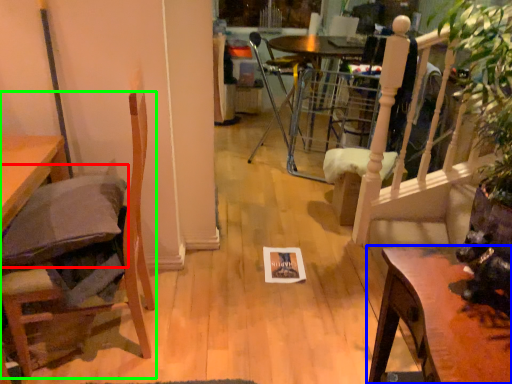
Question: Based on their relative distances, which object is farther from pillow (highlighted by a red box)? Choose from table (highlighted by a blue box) and chair (highlighted by a green box).

Choices:
 (A) table
 (B) chair

Answer: (A)